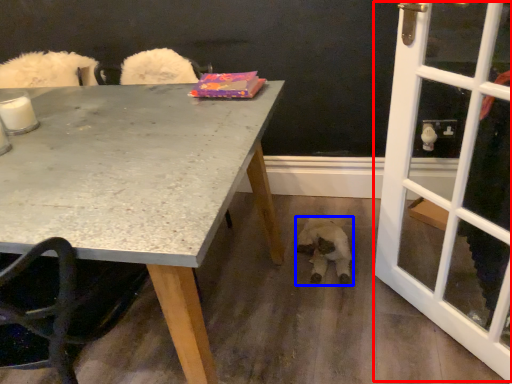
Question: Which object appears closest to the camera in this image, screen door (highlighted by a red box) or animal (highlighted by a blue box)?

Choices:
 (A) screen door
 (B) animal

Answer: (A)